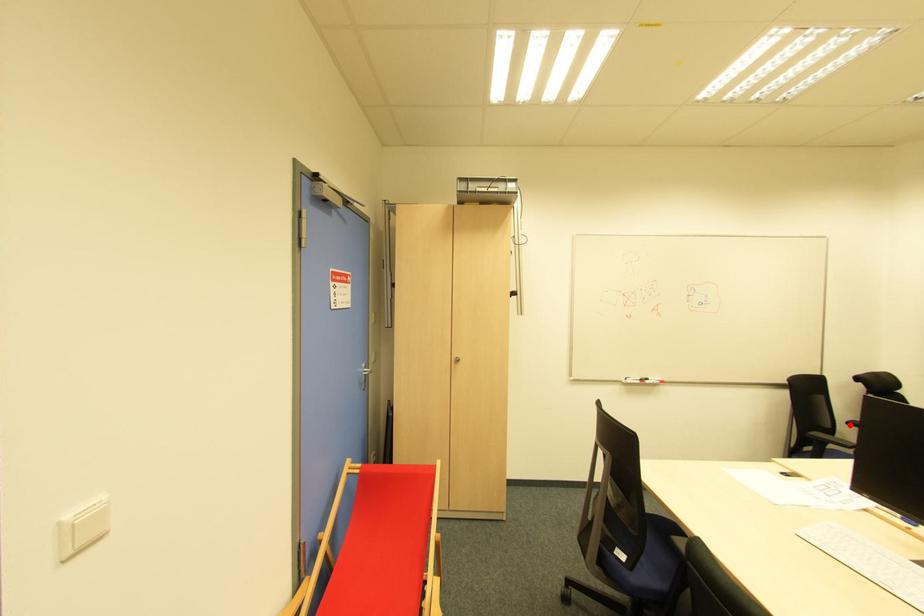
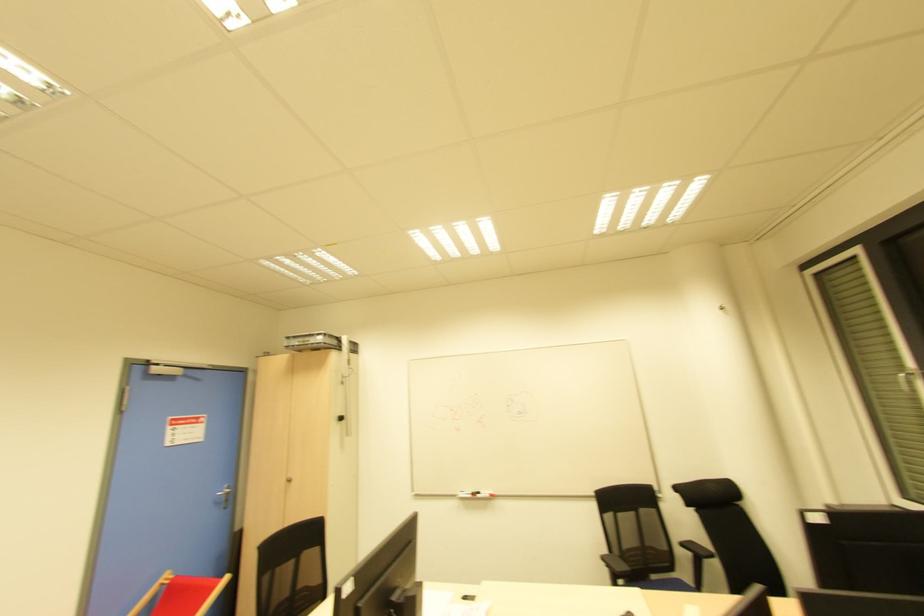
Question: I am providing you with two images of the same scene from different viewpoints. Image1 has a red point marked. In image2, the corresponding 3D location appears at what relative position? Reply with the corresponding letter.

Choices:
 (A) Closer
 (B) Farther

Answer: (A)